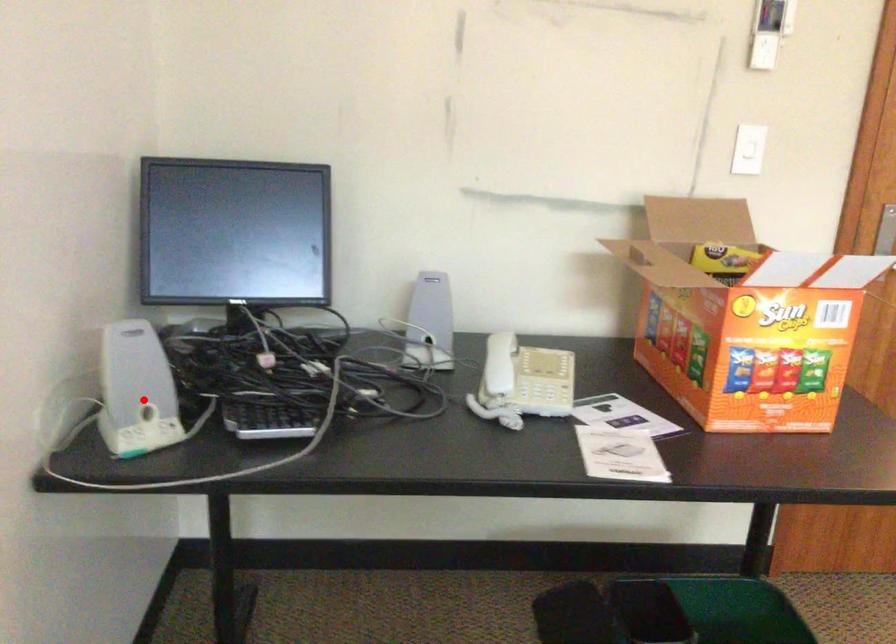
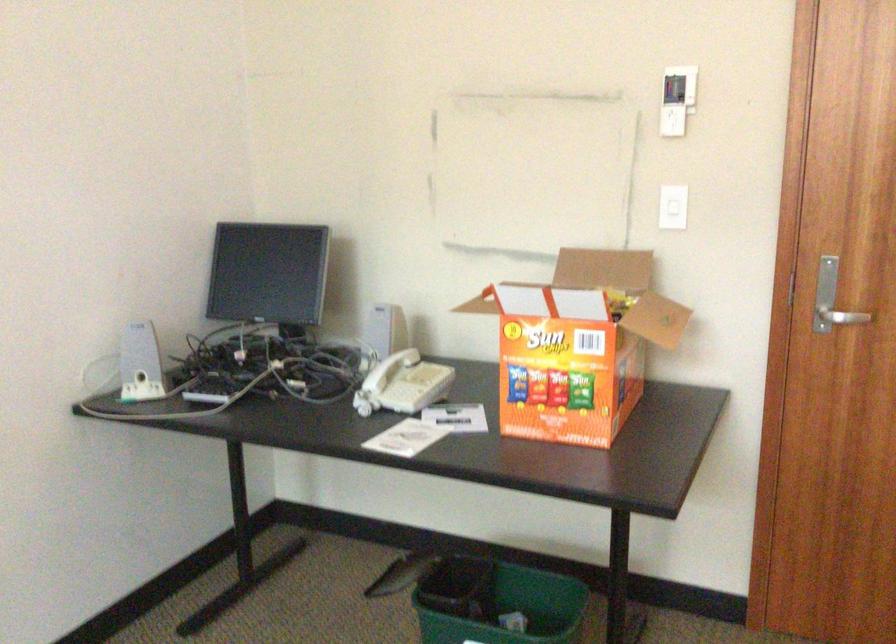
Find the pixel in the second image that matches the highlighted location in the first image.

(140, 363)